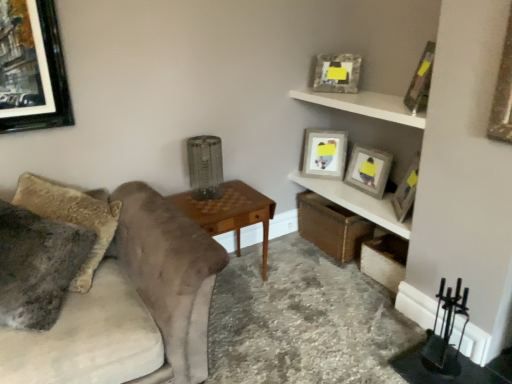
Identify the location of empty space that is to the right of woodenobject at center. This screenshot has width=512, height=384. (295, 298).